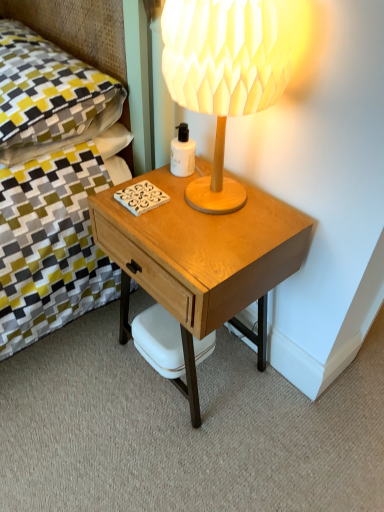
What are the coordinates of `vacant area that is in front of wooden lampshade at upper right` in the screenshot? It's located at (210, 243).